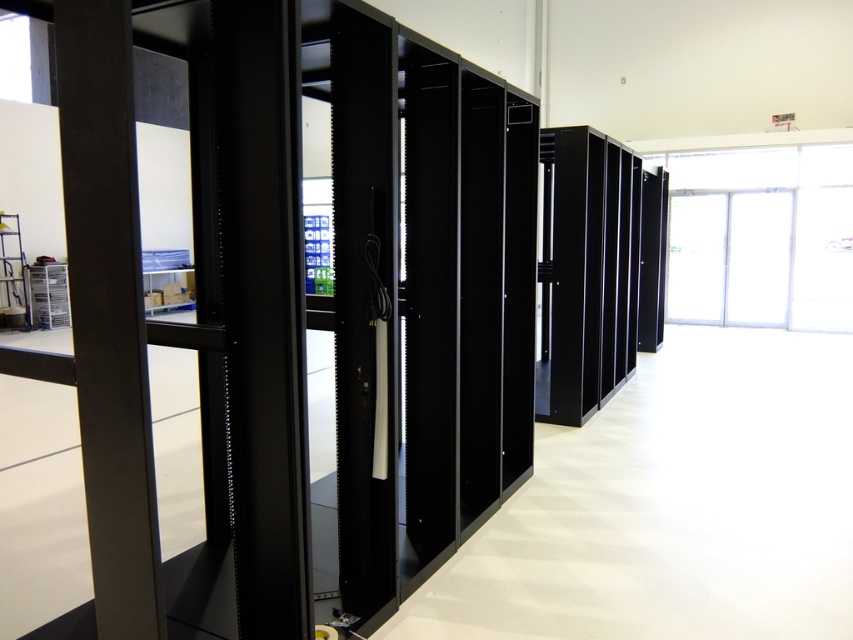
Question: Which of the following is the farthest from the observer?

Choices:
 (A) (599, 232)
 (B) (96, 40)

Answer: (A)

Question: Is matte black pillar at left positioned at the back of black matte server rack at center?

Choices:
 (A) no
 (B) yes

Answer: (A)

Question: Which point is closer to the camera?

Choices:
 (A) black matte server rack at center
 (B) matte black pillar at left

Answer: (B)

Question: Can you confirm if matte black pillar at left is positioned above black matte server rack at center?

Choices:
 (A) yes
 (B) no

Answer: (B)

Question: Does matte black pillar at left have a lesser width compared to black matte server rack at center?

Choices:
 (A) no
 (B) yes

Answer: (B)

Question: Which object is closer to the camera taking this photo?

Choices:
 (A) matte black pillar at left
 (B) black matte server rack at center

Answer: (A)